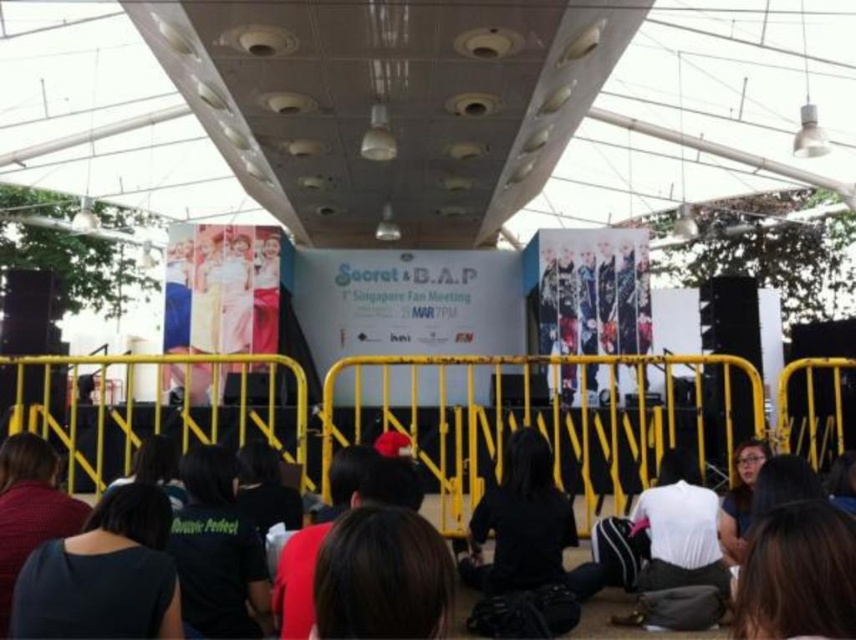
Who is lower down, dark blue fabric at lower left or black fabric crowd at lower center?

black fabric crowd at lower center is lower down.

Which is in front, point (40, 621) or point (150, 528)?

Point (40, 621) is in front.

Which is behind, point (39, 557) or point (140, 484)?

Positioned behind is point (140, 484).

The image size is (856, 640). In order to click on dark blue fabric at lower left in this screenshot , I will do `click(104, 573)`.